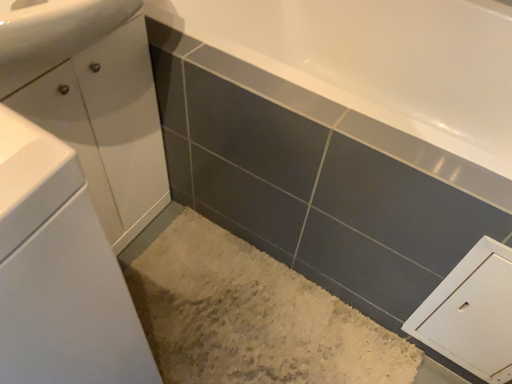
Question: Is white matte cabinet at lower right turned away from white glossy cabinet at left, the 2th bathroom cabinet positioned from the front?

Choices:
 (A) no
 (B) yes

Answer: (A)

Question: Is white matte cabinet at lower right surrounding white glossy cabinet at left, the 1th bathroom cabinet from the back?

Choices:
 (A) yes
 (B) no

Answer: (B)

Question: From a real-world perspective, is white matte cabinet at lower right over white glossy cabinet at left, the 2th bathroom cabinet positioned from the front?

Choices:
 (A) no
 (B) yes

Answer: (A)

Question: Considering the relative sizes of white matte cabinet at lower right and white glossy cabinet at left, the 1th bathroom cabinet from the back, in the image provided, is white matte cabinet at lower right taller than white glossy cabinet at left, the 1th bathroom cabinet from the back,?

Choices:
 (A) no
 (B) yes

Answer: (A)

Question: Does white matte cabinet at lower right have a lesser width compared to white glossy cabinet at left, the 2th bathroom cabinet positioned from the front?

Choices:
 (A) no
 (B) yes

Answer: (B)

Question: Looking at the image, does white matte cabinet at lower right seem bigger or smaller compared to white glossy cabinet at left, the 1th bathroom cabinet when ordered from front to back?

Choices:
 (A) small
 (B) big

Answer: (A)

Question: Is white matte cabinet at lower right spatially inside white glossy cabinet at left, the 1th bathroom cabinet when ordered from front to back, or outside of it?

Choices:
 (A) outside
 (B) inside

Answer: (A)

Question: In terms of height, does white matte cabinet at lower right look taller or shorter compared to white glossy cabinet at left, the 1th bathroom cabinet when ordered from front to back?

Choices:
 (A) short
 (B) tall

Answer: (A)

Question: Considering their positions, is white matte cabinet at lower right located in front of or behind white glossy cabinet at left, the 1th bathroom cabinet when ordered from front to back?

Choices:
 (A) behind
 (B) front

Answer: (A)

Question: From the image's perspective, is white glossy cabinet at left, the 2th bathroom cabinet positioned from the front, located above or below white glossy cabinet at left, which ranks as the 2th bathroom cabinet in back-to-front order?

Choices:
 (A) above
 (B) below

Answer: (A)

Question: In the image, is white glossy cabinet at left, the 1th bathroom cabinet from the back, positioned in front of or behind white glossy cabinet at left, the 1th bathroom cabinet when ordered from front to back?

Choices:
 (A) front
 (B) behind

Answer: (B)

Question: Do you think white glossy cabinet at left, the 1th bathroom cabinet from the back, is within white glossy cabinet at left, the 1th bathroom cabinet when ordered from front to back, or outside of it?

Choices:
 (A) inside
 (B) outside

Answer: (B)

Question: Is point (59, 71) closer or farther from the camera than point (61, 289)?

Choices:
 (A) farther
 (B) closer

Answer: (A)

Question: Is white glossy cabinet at left, the 1th bathroom cabinet when ordered from front to back, to the left or to the right of white glossy cabinet at left, the 2th bathroom cabinet positioned from the front, in the image?

Choices:
 (A) left
 (B) right

Answer: (A)

Question: Based on their sizes in the image, would you say white glossy cabinet at left, which ranks as the 2th bathroom cabinet in back-to-front order, is bigger or smaller than white glossy cabinet at left, the 1th bathroom cabinet from the back?

Choices:
 (A) small
 (B) big

Answer: (B)